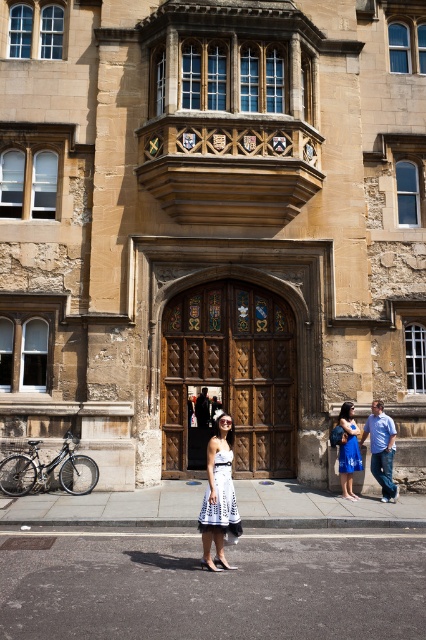
You are a GUI agent. You are given a task and a screenshot of the screen. Output one action in this format:
    pyautogui.click(x=<x>, y=<y>)
    Task: Click on the wooden door at center
    
    Given the screenshot: What is the action you would take?
    pyautogui.click(x=229, y=378)

Who is higher up, wooden door at center or blue denim jeans at lower right?

wooden door at center is higher up.

Does point (276, 326) come in front of point (374, 401)?

No, (276, 326) is further to viewer.

The width and height of the screenshot is (426, 640). What are the coordinates of `wooden door at center` in the screenshot? It's located at (229, 378).

Does wooden door at center have a greater height compared to white lace dress at center?

Correct, wooden door at center is much taller as white lace dress at center.

Who is positioned more to the right, wooden door at center or white lace dress at center?

wooden door at center

The image size is (426, 640). What do you see at coordinates (229, 378) in the screenshot?
I see `wooden door at center` at bounding box center [229, 378].

Where is `wooden door at center`? Image resolution: width=426 pixels, height=640 pixels. wooden door at center is located at coordinates (229, 378).

Which of these two, white lace dress at center or blue denim jeans at lower right, stands shorter?

Standing shorter between the two is white lace dress at center.

Describe the element at coordinates (221, 500) in the screenshot. This screenshot has height=640, width=426. I see `white lace dress at center` at that location.

Who is more forward, (204, 497) or (385, 461)?

Positioned in front is point (385, 461).

Where is `white lace dress at center`? white lace dress at center is located at coordinates 221,500.